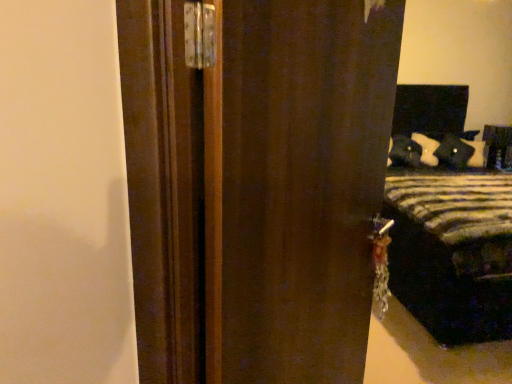
Question: Can striped fabric bed at right be found inside velvet black pillow at right?

Choices:
 (A) no
 (B) yes

Answer: (A)

Question: From a real-world perspective, is velvet black pillow at right on top of striped fabric bed at right?

Choices:
 (A) yes
 (B) no

Answer: (A)

Question: Is velvet black pillow at right taller than striped fabric bed at right?

Choices:
 (A) yes
 (B) no

Answer: (B)

Question: From a real-world perspective, is velvet black pillow at right located beneath striped fabric bed at right?

Choices:
 (A) no
 (B) yes

Answer: (A)

Question: Is velvet black pillow at right in front of striped fabric bed at right?

Choices:
 (A) yes
 (B) no

Answer: (B)

Question: Is point (317, 51) positioned closer to the camera than point (454, 160)?

Choices:
 (A) closer
 (B) farther

Answer: (A)

Question: In terms of width, does dark wood door at center look wider or thinner when compared to velvet black pillow at right?

Choices:
 (A) thin
 (B) wide

Answer: (A)

Question: Based on their sizes in the image, would you say dark wood door at center is bigger or smaller than velvet black pillow at right?

Choices:
 (A) small
 (B) big

Answer: (B)

Question: Is dark wood door at center taller or shorter than velvet black pillow at right?

Choices:
 (A) short
 (B) tall

Answer: (B)

Question: From a real-world perspective, is striped fabric bed at right physically located above or below dark wood door at center?

Choices:
 (A) below
 (B) above

Answer: (A)

Question: Considering the positions of striped fabric bed at right and dark wood door at center in the image, is striped fabric bed at right wider or thinner than dark wood door at center?

Choices:
 (A) wide
 (B) thin

Answer: (A)

Question: Considering their positions, is striped fabric bed at right located in front of or behind dark wood door at center?

Choices:
 (A) behind
 (B) front

Answer: (A)

Question: Is point (464, 248) closer or farther from the camera than point (266, 309)?

Choices:
 (A) farther
 (B) closer

Answer: (A)

Question: Is point (458, 144) positioned closer to the camera than point (475, 276)?

Choices:
 (A) farther
 (B) closer

Answer: (A)

Question: Is velvet black pillow at right inside or outside of striped fabric bed at right?

Choices:
 (A) outside
 (B) inside

Answer: (B)